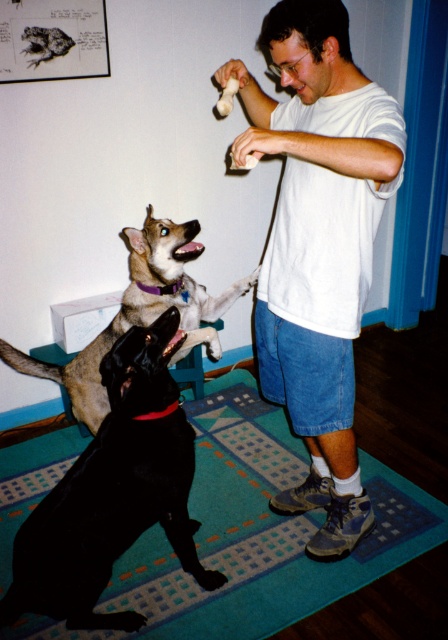
Which is more to the right, teal carpet at lower center or black glossy dog at lower left?

Positioned to the right is teal carpet at lower center.

The image size is (448, 640). What do you see at coordinates (253, 532) in the screenshot? I see `teal carpet at lower center` at bounding box center [253, 532].

Between point (214, 547) and point (51, 560), which one is positioned behind?

The point (214, 547) is more distant.

This screenshot has height=640, width=448. What are the coordinates of `teal carpet at lower center` in the screenshot? It's located at [x=253, y=532].

Is point (369, 132) behind point (85, 577)?

No, (369, 132) is in front of (85, 577).

Who is more forward, (x=266, y=99) or (x=129, y=349)?

Point (x=129, y=349) is in front.

This screenshot has height=640, width=448. Describe the element at coordinates (318, 244) in the screenshot. I see `white cotton shirt at center` at that location.

Image resolution: width=448 pixels, height=640 pixels. Identify the location of white cotton shirt at center. (318, 244).

Does black glossy dog at lower left appear on the right side of light brown fur at center?

Correct, you'll find black glossy dog at lower left to the right of light brown fur at center.

Who is taller, black glossy dog at lower left or light brown fur at center?

black glossy dog at lower left is taller.

Between point (172, 433) and point (136, 296), which one is positioned in front?

Positioned in front is point (172, 433).

This screenshot has width=448, height=640. Find the location of `black glossy dog at lower left`. black glossy dog at lower left is located at coordinates pyautogui.click(x=113, y=492).